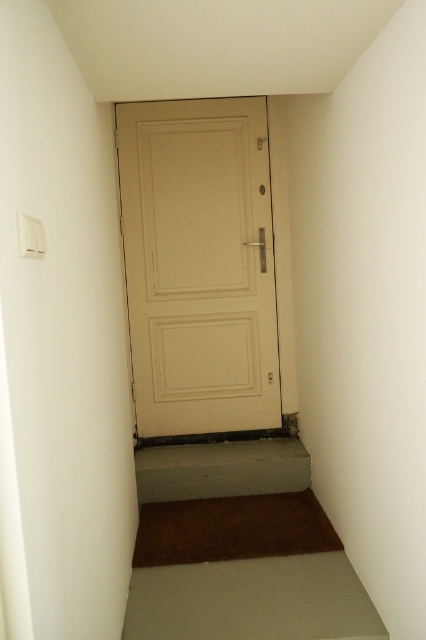
Describe the element at coordinates (198, 266) in the screenshot. I see `beige matte door at center` at that location.

Is beige matte door at center in front of brown carpet at lower center?

No, it is not.

The height and width of the screenshot is (640, 426). What do you see at coordinates (198, 266) in the screenshot? I see `beige matte door at center` at bounding box center [198, 266].

You are a GUI agent. You are given a task and a screenshot of the screen. Output one action in this format:
    pyautogui.click(x=<x>, y=<y>)
    Task: Click on the beige matte door at center
    The image size is (426, 640).
    Given the screenshot: What is the action you would take?
    pyautogui.click(x=198, y=266)